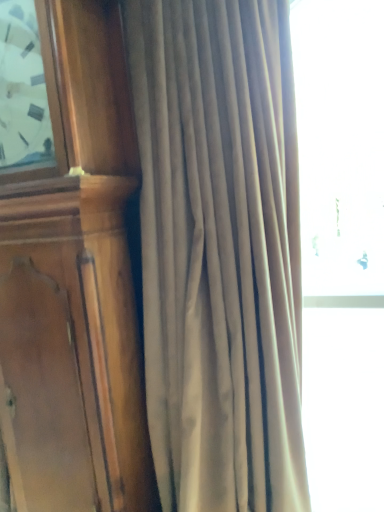
Question: Is wooden clock at left not close to satin beige curtain at center?

Choices:
 (A) yes
 (B) no

Answer: (B)

Question: Is wooden clock at left oriented towards satin beige curtain at center?

Choices:
 (A) no
 (B) yes

Answer: (A)

Question: Is wooden clock at left in front of satin beige curtain at center?

Choices:
 (A) yes
 (B) no

Answer: (B)

Question: Can you confirm if wooden clock at left is taller than satin beige curtain at center?

Choices:
 (A) yes
 (B) no

Answer: (A)

Question: Considering the relative sizes of wooden clock at left and satin beige curtain at center in the image provided, is wooden clock at left smaller than satin beige curtain at center?

Choices:
 (A) yes
 (B) no

Answer: (A)

Question: From the image's perspective, is wooden clock at left under satin beige curtain at center?

Choices:
 (A) no
 (B) yes

Answer: (A)

Question: From a real-world perspective, does satin beige curtain at center stand above wooden clock at left?

Choices:
 (A) yes
 (B) no

Answer: (B)

Question: Considering the relative sizes of satin beige curtain at center and wooden clock at left in the image provided, is satin beige curtain at center thinner than wooden clock at left?

Choices:
 (A) no
 (B) yes

Answer: (A)

Question: Can you see satin beige curtain at center touching wooden clock at left?

Choices:
 (A) no
 (B) yes

Answer: (A)

Question: Is satin beige curtain at center turned away from wooden clock at left?

Choices:
 (A) yes
 (B) no

Answer: (B)

Question: Is satin beige curtain at center outside wooden clock at left?

Choices:
 (A) yes
 (B) no

Answer: (A)

Question: Is satin beige curtain at center at the right side of wooden clock at left?

Choices:
 (A) no
 (B) yes

Answer: (B)

Question: Is wooden clock at left spatially inside satin beige curtain at center, or outside of it?

Choices:
 (A) inside
 (B) outside

Answer: (B)